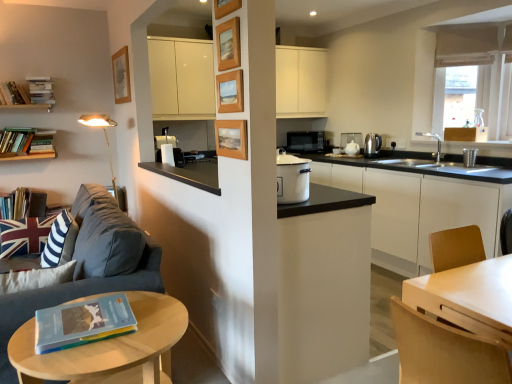
Question: Is hardcover book at left, which is the second book from top to bottom, in front of or behind hardcover book at lower left, the sixth book viewed from the top, in the image?

Choices:
 (A) front
 (B) behind

Answer: (B)

Question: In terms of width, does hardcover book at left, which is the second book from top to bottom, look wider or thinner when compared to hardcover book at lower left, the first book when ordered from front to back?

Choices:
 (A) wide
 (B) thin

Answer: (B)

Question: Considering the real-world distances, which object is farthest from the beige fabric curtain at upper right?

Choices:
 (A) metallic stainless steel cup at right, marked as the fifth appliance in a left-to-right arrangement
 (B) white ceramic teapot at center-right, marked as the 4th appliance in a front-to-back arrangement
 (C) black matte microwave at center, the 5th appliance positioned from the right
 (D) dark gray fabric couch at left
 (E) white ceramic teapot at center, positioned as the third appliance in back-to-front order

Answer: (D)

Question: Based on their relative distances, which object is farther from the hardcover books at upper left, which is the 1th book from top to bottom?

Choices:
 (A) satin silver kettle at right, placed as the second appliance when sorted from front to back
 (B) hardcover book at left, which is the 3th book from left to right
 (C) beige fabric curtain at upper right
 (D) light brown wood chair at lower right
 (E) dark gray fabric couch at left

Answer: (D)